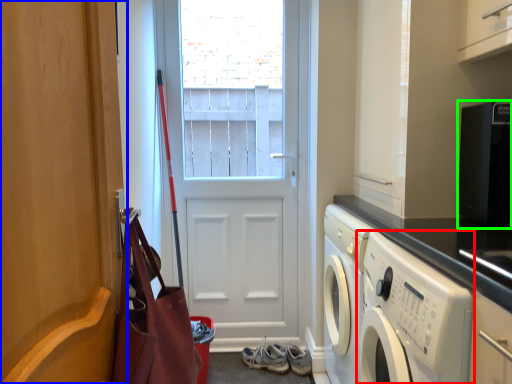
Question: Which object is the farthest from washing machine (highlighted by a red box)? Choose among these: door (highlighted by a blue box) or appliance (highlighted by a green box).

Choices:
 (A) door
 (B) appliance

Answer: (A)